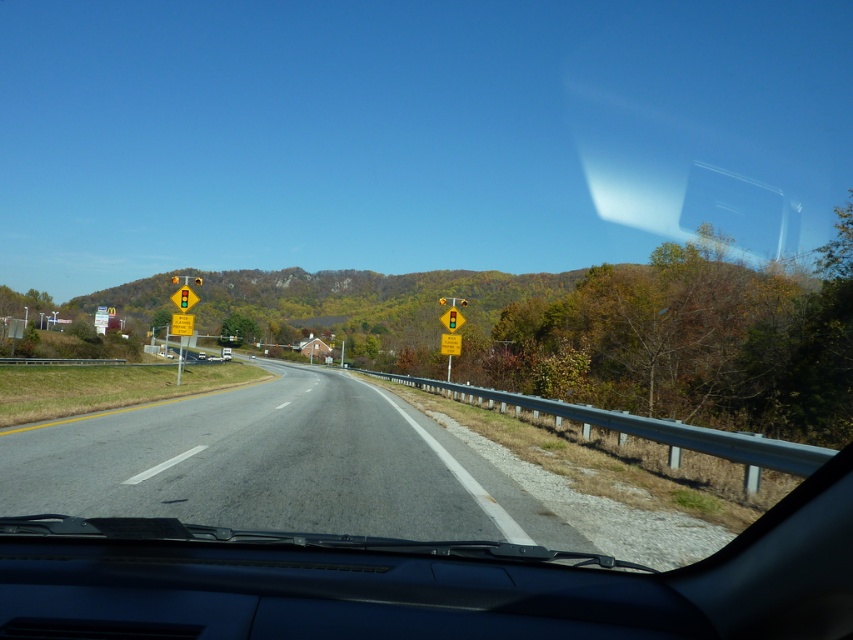
Question: Estimate the real-world distances between objects in this image. Which object is closer to the yellow plastic traffic light at center?

Choices:
 (A) yellow reflective diamond at center
 (B) yellow plastic traffic sign at center

Answer: (A)

Question: Which object is closer to the camera taking this photo?

Choices:
 (A) yellow plastic traffic sign at center
 (B) asphalt road at center
 (C) yellow plastic traffic light at center
 (D) yellow reflective diamond at center

Answer: (B)

Question: From the image, what is the correct spatial relationship of yellow reflective diamond at center in relation to yellow plastic traffic light at center?

Choices:
 (A) right
 (B) left

Answer: (B)

Question: Can you confirm if asphalt road at center is thinner than yellow reflective diamond at center?

Choices:
 (A) yes
 (B) no

Answer: (B)

Question: Among these objects, which one is nearest to the camera?

Choices:
 (A) asphalt road at center
 (B) yellow reflective diamond at center
 (C) yellow plastic traffic light at center
 (D) yellow plastic traffic sign at center

Answer: (A)

Question: Is yellow reflective diamond at center above yellow plastic traffic light at center?

Choices:
 (A) no
 (B) yes

Answer: (A)